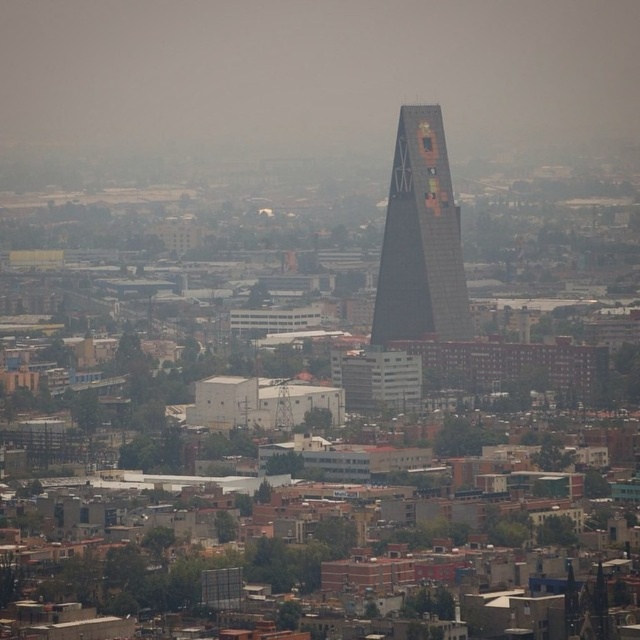
Is the position of transparent fog at center more distant than that of dark glass skyscraper at center?

Yes, transparent fog at center is behind dark glass skyscraper at center.

Is transparent fog at center taller than dark glass skyscraper at center?

Incorrect, transparent fog at center's height is not larger of dark glass skyscraper at center's.

Does point (552, 140) lie behind point (440, 157)?

Yes, point (552, 140) is behind point (440, 157).

Identify the location of transparent fog at center. (312, 76).